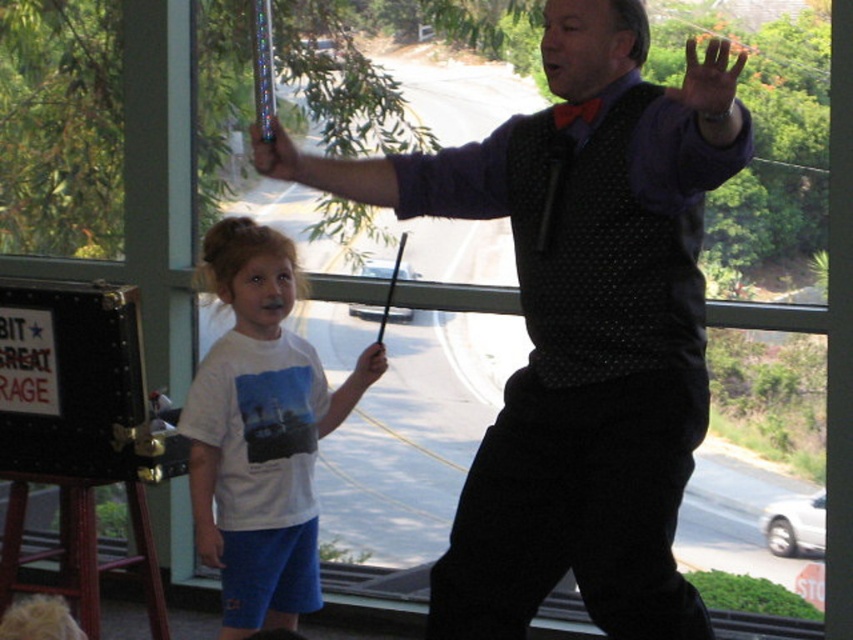
You are a costume designer looking at the image and need to adjust the placement of the polka dot vest at center and the smooth skin hand at upper right. Based on the scene, which object is positioned to the left of the other?

The polka dot vest at center is to the left of smooth skin hand at upper right.

You are standing in the room and want to place a 4.5 meter long banner between the black leather easel at left and the window in the background. Is there enough space?

The black leather easel at left is 4.20 meters from viewer. Since the banner is 4.5 meters long, it would require more space than available between the easel and the window. Therefore, the banner cannot be placed there.